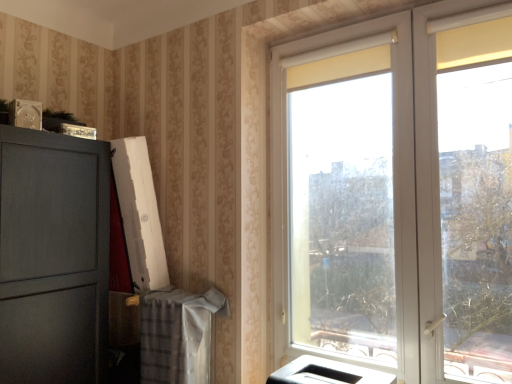
The width and height of the screenshot is (512, 384). What are the coordinates of `white plastic window at right` in the screenshot? It's located at (397, 194).

What is the approximate height of white plastic window at right?

white plastic window at right is 1.69 meters tall.

In order to face white plastic window at right, should I rotate leftwards or rightwards?

Rotate right and turn 16.931 degrees.

What do you see at coordinates (397, 194) in the screenshot?
I see `white plastic window at right` at bounding box center [397, 194].

Image resolution: width=512 pixels, height=384 pixels. What do you see at coordinates (327, 373) in the screenshot? I see `white glossy printer at lower center` at bounding box center [327, 373].

The width and height of the screenshot is (512, 384). Find the location of `white glossy printer at lower center`. white glossy printer at lower center is located at coordinates (327, 373).

Identify the location of white plastic window at right. (397, 194).

Considering the relative positions of white glossy printer at lower center and white plastic window at right in the image provided, is white glossy printer at lower center to the right of white plastic window at right from the viewer's perspective?

Incorrect, white glossy printer at lower center is not on the right side of white plastic window at right.

Which object is closer to the camera taking this photo, white glossy printer at lower center or white plastic window at right?

Positioned in front is white plastic window at right.

Considering the points (298, 383) and (372, 339), which point is behind, point (298, 383) or point (372, 339)?

Point (372, 339)

From the image's perspective, is white glossy printer at lower center located above or below white plastic window at right?

From the image's perspective, white glossy printer at lower center appears below white plastic window at right.

From a real-world perspective, is white glossy printer at lower center positioned above or below white plastic window at right?

In terms of real-world spatial position, white glossy printer at lower center is below white plastic window at right.

Which of these two, white glossy printer at lower center or white plastic window at right, is thinner?

white glossy printer at lower center.

Looking at this image, considering the relative sizes of white glossy printer at lower center and white plastic window at right in the image provided, is white glossy printer at lower center taller than white plastic window at right?

In fact, white glossy printer at lower center may be shorter than white plastic window at right.

Who is bigger, white glossy printer at lower center or white plastic window at right?

With larger size is white plastic window at right.

Is white glossy printer at lower center inside or outside of white plastic window at right?

white glossy printer at lower center lies outside white plastic window at right.

Is white glossy printer at lower center far from white plastic window at right?

white glossy printer at lower center is actually quite close to white plastic window at right.

Could you tell me if white glossy printer at lower center is facing white plastic window at right?

No, white glossy printer at lower center is not oriented towards white plastic window at right.

How different are the orientations of white glossy printer at lower center and white plastic window at right in degrees?

They differ by 0.00348 degrees in their facing directions.

The width and height of the screenshot is (512, 384). In the image, there is a white plastic window at right. What are the coordinates of `appliance below it (from a real-world perspective)` in the screenshot? It's located at (327, 373).

Is white plastic window at right to the left or to the right of white glossy printer at lower center in the image?

white plastic window at right is positioned on white glossy printer at lower center's right side.

Is white plastic window at right in front of white glossy printer at lower center?

Yes, it is.

Does point (380, 100) come closer to viewer compared to point (291, 371)?

Yes, point (380, 100) is closer to viewer.

From the image's perspective, which object appears higher, white plastic window at right or white glossy printer at lower center?

white plastic window at right is shown above in the image.

From a real-world perspective, is white plastic window at right over white glossy printer at lower center?

Yes, from a real-world perspective, white plastic window at right is on top of white glossy printer at lower center.

In terms of width, does white plastic window at right look wider or thinner when compared to white glossy printer at lower center?

In the image, white plastic window at right appears to be wider than white glossy printer at lower center.

Between white plastic window at right and white glossy printer at lower center, which one has more height?

white plastic window at right is taller.

Is white plastic window at right smaller than white glossy printer at lower center?

No, white plastic window at right is not smaller than white glossy printer at lower center.

Would you say white plastic window at right contains white glossy printer at lower center?

No, white glossy printer at lower center is not inside white plastic window at right.

Are white plastic window at right and white glossy printer at lower center making contact?

white plastic window at right and white glossy printer at lower center are not in contact.

Is white plastic window at right turned away from white glossy printer at lower center?

That's right, white plastic window at right is facing away from white glossy printer at lower center.

What's the angular difference between white plastic window at right and white glossy printer at lower center's facing directions?

The angular difference between white plastic window at right and white glossy printer at lower center is 0.00348 degrees.

Measure the distance from white plastic window at right to white glossy printer at lower center.

25.12 inches.

The height and width of the screenshot is (384, 512). Identify the location of window above the white glossy printer at lower center (from the image's perspective). (397, 194).

Image resolution: width=512 pixels, height=384 pixels. What are the coordinates of `appliance directly beneath the white plastic window at right (from a real-world perspective)` in the screenshot? It's located at (327, 373).

You are a GUI agent. You are given a task and a screenshot of the screen. Output one action in this format:
    pyautogui.click(x=<x>, y=<y>)
    Task: Click on the window that appears above the white glossy printer at lower center (from a real-world perspective)
    This screenshot has height=384, width=512.
    Given the screenshot: What is the action you would take?
    pyautogui.click(x=397, y=194)